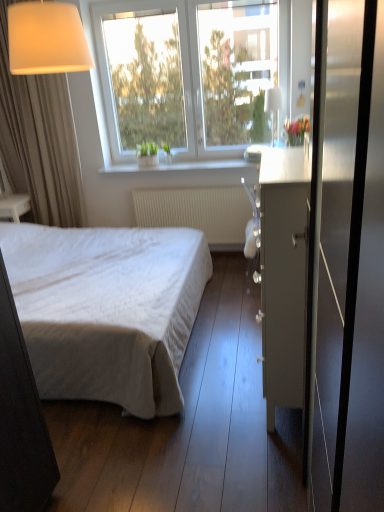
You are a GUI agent. You are given a task and a screenshot of the screen. Output one action in this format:
    pyautogui.click(x=<x>, y=<y>)
    Task: Click on the space that is in front of matte gray cabinet at center-right
    The image size is (384, 512).
    Given the screenshot: What is the action you would take?
    pyautogui.click(x=246, y=459)